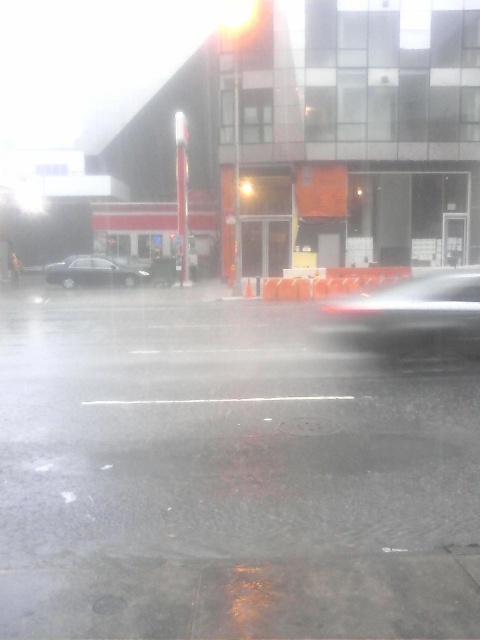
Does satin black sedan at center lie behind orange plastic barrier at center?

That is True.

Who is shorter, satin black sedan at center or orange plastic barrier at center?

With less height is orange plastic barrier at center.

This screenshot has width=480, height=640. In order to click on satin black sedan at center in this screenshot , I will do `click(93, 273)`.

Can you confirm if shiny silver sedan at center is taller than satin black sedan at center?

Correct, shiny silver sedan at center is much taller as satin black sedan at center.

Which of these two, shiny silver sedan at center or satin black sedan at center, stands shorter?

satin black sedan at center

Between point (406, 326) and point (80, 275), which one is positioned behind?

Positioned behind is point (80, 275).

I want to click on shiny silver sedan at center, so point(409,316).

Which is behind, point (443, 272) or point (330, 282)?

The point (443, 272) is behind.

What do you see at coordinates (409, 316) in the screenshot? I see `shiny silver sedan at center` at bounding box center [409, 316].

Does point (454, 278) come farther from viewer compared to point (323, 294)?

No, (454, 278) is in front of (323, 294).

The width and height of the screenshot is (480, 640). I want to click on shiny silver sedan at center, so [409, 316].